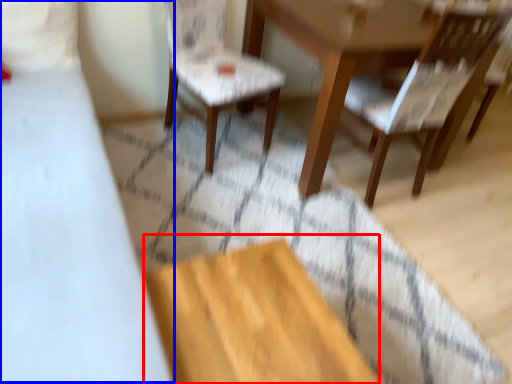
Question: Which object appears farthest to the camera in this image, plywood (highlighted by a red box) or bed (highlighted by a blue box)?

Choices:
 (A) plywood
 (B) bed

Answer: (A)